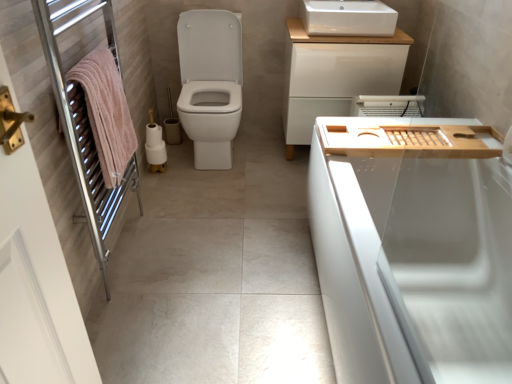
Locate an element on the screen. free space on the front side of pink towel at left is located at coordinates (147, 312).